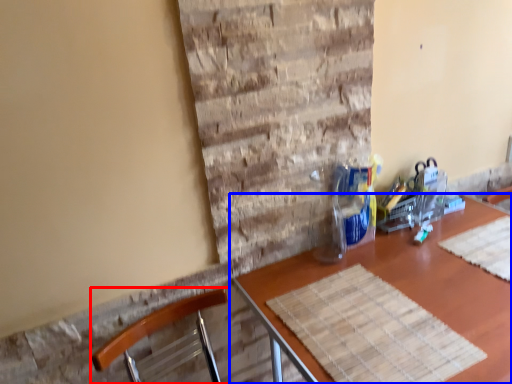
Question: Which object appears farthest to the camera in this image, chair (highlighted by a red box) or table (highlighted by a blue box)?

Choices:
 (A) chair
 (B) table

Answer: (B)